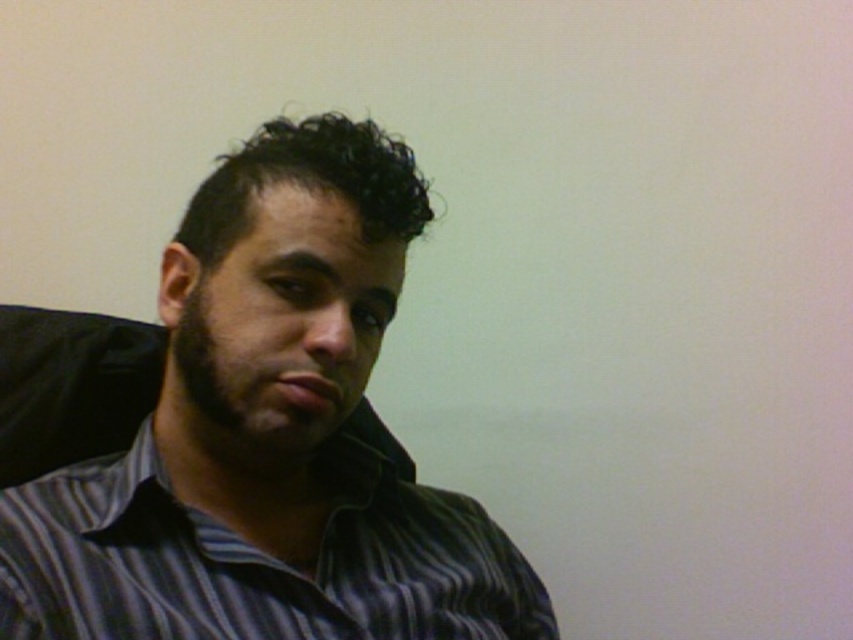
Can you confirm if striped shirt at center is positioned below striped cotton shirt at center?

Incorrect, striped shirt at center is not positioned below striped cotton shirt at center.

Which is behind, point (247, 636) or point (126, 618)?

The point (247, 636) is more distant.

Who is more distant from viewer, (x=112, y=518) or (x=22, y=566)?

The point (x=112, y=518) is behind.

Identify the location of striped shirt at center. Image resolution: width=853 pixels, height=640 pixels. (268, 436).